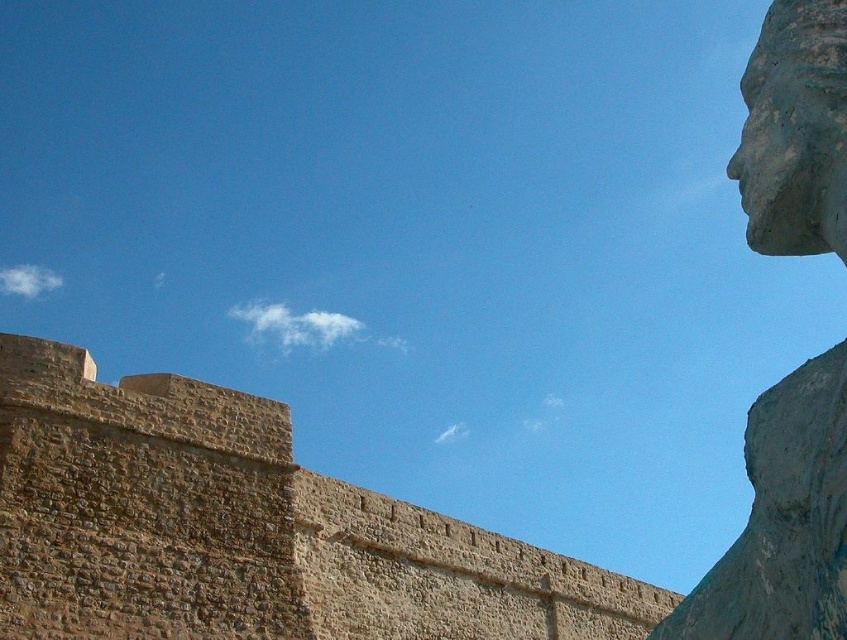
Question: Can you confirm if brown stone wall at center is thinner than rustic stone head at upper right?

Choices:
 (A) no
 (B) yes

Answer: (B)

Question: Which of the following is the closest to the observer?

Choices:
 (A) (792, 236)
 (B) (765, 58)
 (C) (6, 349)

Answer: (A)

Question: Can you confirm if green stone face at upper right is bigger than rustic stone head at upper right?

Choices:
 (A) yes
 (B) no

Answer: (A)

Question: Which point is closer to the camera taking this photo?

Choices:
 (A) (815, 134)
 (B) (782, 83)

Answer: (A)

Question: Can you confirm if green stone face at upper right is smaller than rustic stone head at upper right?

Choices:
 (A) yes
 (B) no

Answer: (B)

Question: Which point is farther to the camera?

Choices:
 (A) (368, 586)
 (B) (726, 172)
 (C) (834, 68)

Answer: (B)